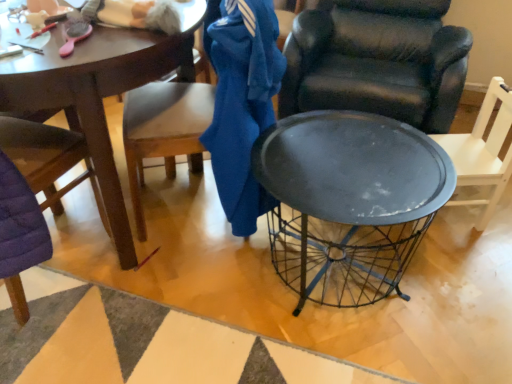
You are a GUI agent. You are given a task and a screenshot of the screen. Output one action in this format:
    pyautogui.click(x=<x>, y=<y>)
    Task: Click on the vacant space that is in between blue cotton jacket at center and metallic wire basket at center
    The image size is (512, 384).
    Given the screenshot: What is the action you would take?
    [x=197, y=275]